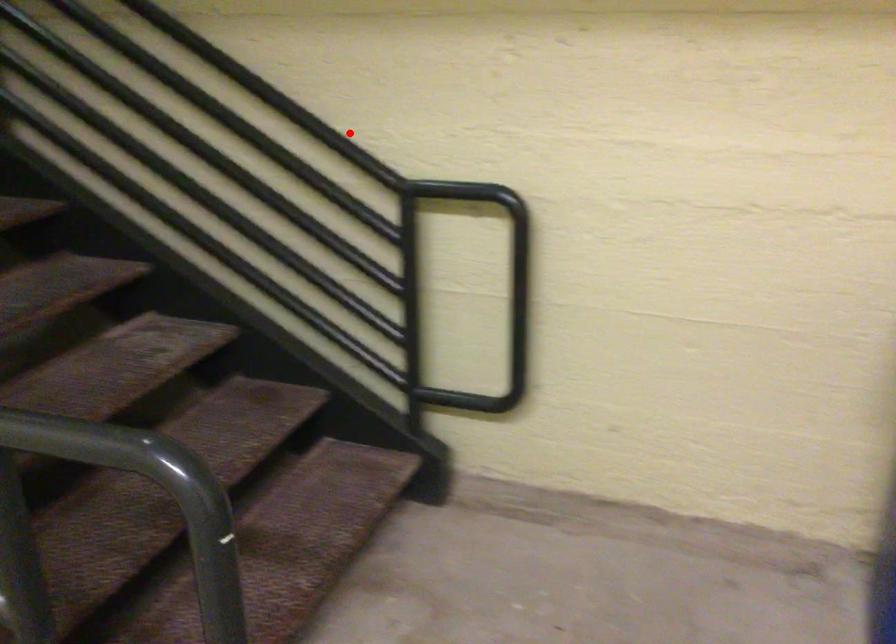
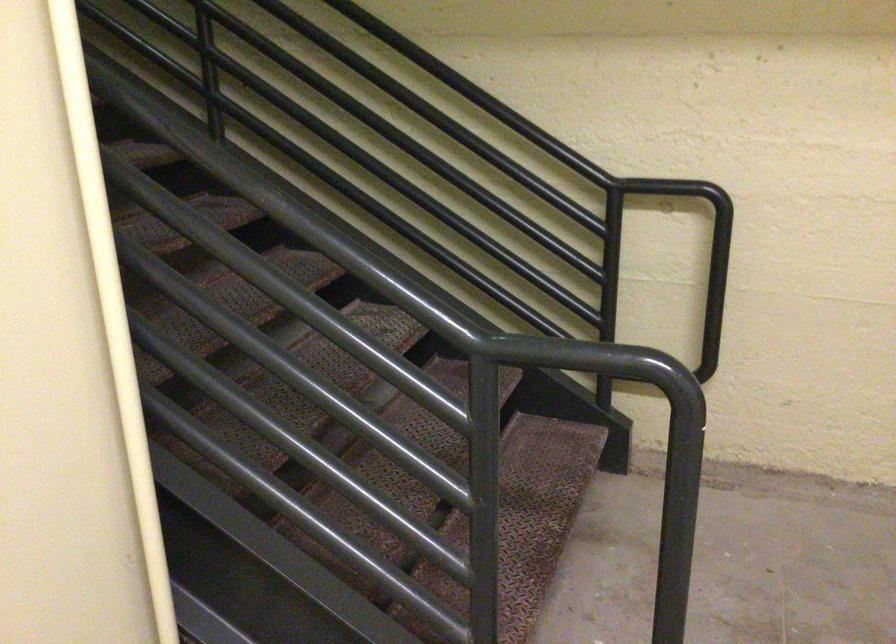
Locate, in the second image, the point that corresponds to the highlighted location in the first image.

(546, 129)